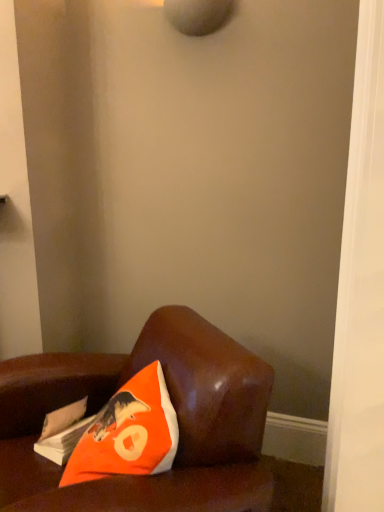
Question: Is the depth of orange fabric pillow at lower left greater than that of white paper magazine at lower left?

Choices:
 (A) no
 (B) yes

Answer: (A)

Question: Can you confirm if orange fabric pillow at lower left is wider than white paper magazine at lower left?

Choices:
 (A) yes
 (B) no

Answer: (A)

Question: From a real-world perspective, is orange fabric pillow at lower left located beneath white paper magazine at lower left?

Choices:
 (A) no
 (B) yes

Answer: (A)

Question: From a real-world perspective, is orange fabric pillow at lower left physically above white paper magazine at lower left?

Choices:
 (A) no
 (B) yes

Answer: (B)

Question: Can you confirm if orange fabric pillow at lower left is positioned to the left of white paper magazine at lower left?

Choices:
 (A) no
 (B) yes

Answer: (A)

Question: Choose the correct answer: Is white paper magazine at lower left inside brown leather couch at lower left or outside it?

Choices:
 (A) inside
 (B) outside

Answer: (A)

Question: From the image's perspective, relative to brown leather couch at lower left, is white paper magazine at lower left above or below?

Choices:
 (A) below
 (B) above

Answer: (B)

Question: Would you say white paper magazine at lower left is to the left or to the right of brown leather couch at lower left in the picture?

Choices:
 (A) right
 (B) left

Answer: (B)

Question: In the image, is white paper magazine at lower left positioned in front of or behind brown leather couch at lower left?

Choices:
 (A) front
 (B) behind

Answer: (B)

Question: Is brown leather couch at lower left wider or thinner than orange fabric pillow at lower left?

Choices:
 (A) wide
 (B) thin

Answer: (A)

Question: Considering the positions of brown leather couch at lower left and orange fabric pillow at lower left in the image, is brown leather couch at lower left bigger or smaller than orange fabric pillow at lower left?

Choices:
 (A) small
 (B) big

Answer: (B)

Question: From a real-world perspective, is brown leather couch at lower left above or below orange fabric pillow at lower left?

Choices:
 (A) below
 (B) above

Answer: (A)

Question: Considering the relative positions of brown leather couch at lower left and orange fabric pillow at lower left in the image provided, is brown leather couch at lower left to the left or to the right of orange fabric pillow at lower left?

Choices:
 (A) right
 (B) left

Answer: (B)

Question: Is white paper magazine at lower left bigger or smaller than orange fabric pillow at lower left?

Choices:
 (A) big
 (B) small

Answer: (B)

Question: Is white paper magazine at lower left in front of or behind orange fabric pillow at lower left in the image?

Choices:
 (A) behind
 (B) front

Answer: (A)